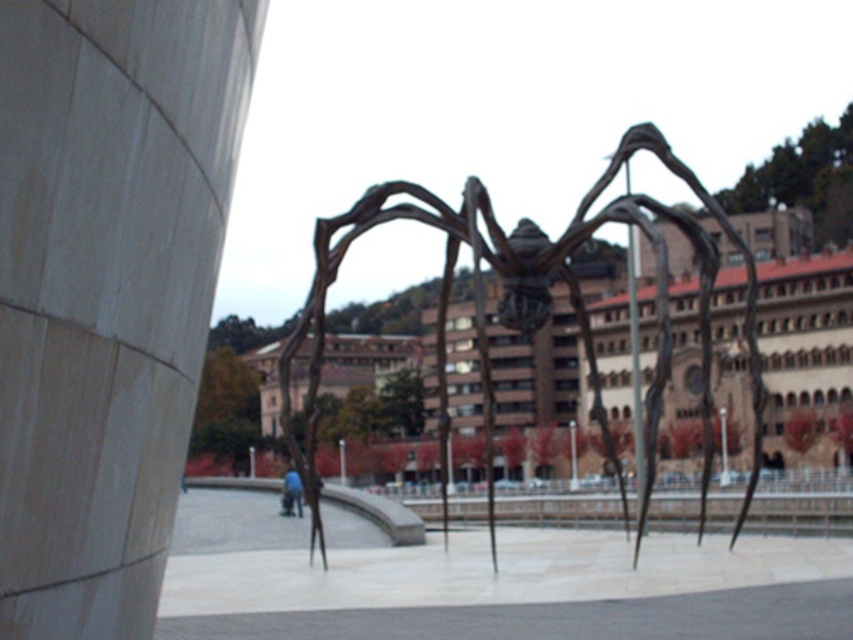
Question: Where is smooth stone pillar at left located in relation to blue fabric pants at center in the image?

Choices:
 (A) below
 (B) above

Answer: (B)

Question: Which point is farther to the camera?

Choices:
 (A) smooth stone pillar at left
 (B) bronze sculpture at center

Answer: (B)

Question: Which of the following is the closest to the observer?

Choices:
 (A) (282, 513)
 (B) (445, 308)
 (C) (65, 564)

Answer: (C)

Question: From the image, what is the correct spatial relationship of smooth stone pillar at left in relation to blue fabric pants at center?

Choices:
 (A) left
 (B) right

Answer: (B)

Question: Is smooth stone pillar at left wider than blue fabric pants at center?

Choices:
 (A) yes
 (B) no

Answer: (B)

Question: Which point is closer to the camera?

Choices:
 (A) pos(653,394)
 (B) pos(143,424)
 (C) pos(299,513)

Answer: (B)